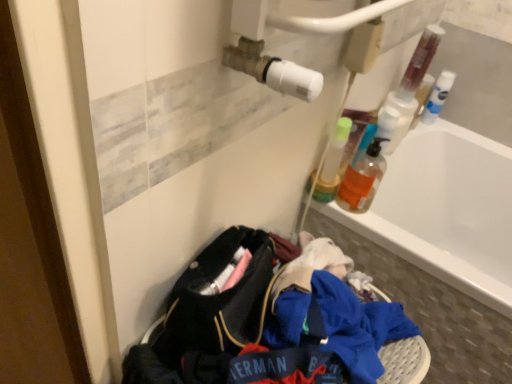
At what (x,y) coordinates should I click in order to perform the action: click on vacant area that lies to the right of white plastic bottle at upper right, which is the first bottle in right-to-left order. Please return your answer as a coordinate pair (x, y). The image size is (512, 384). Looking at the image, I should click on (466, 134).